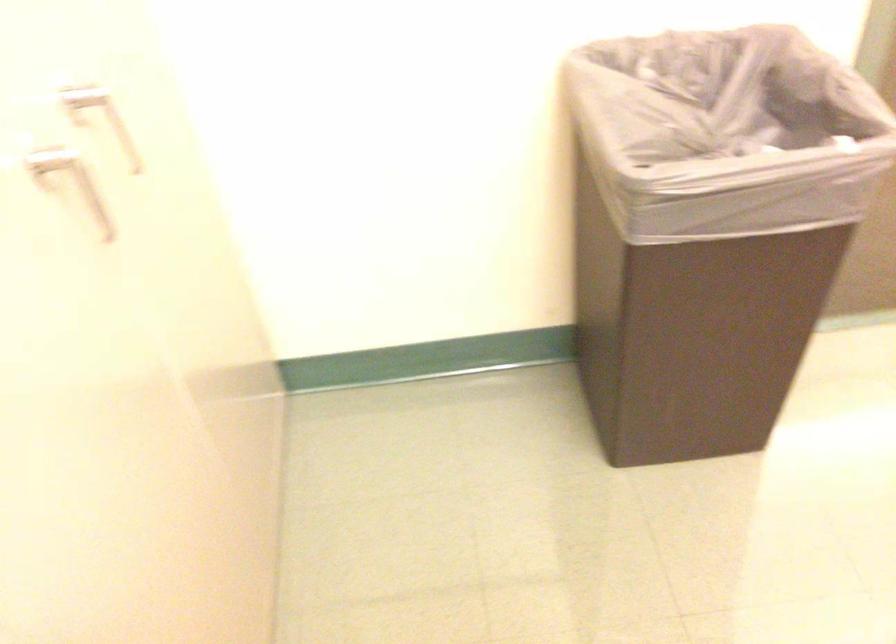
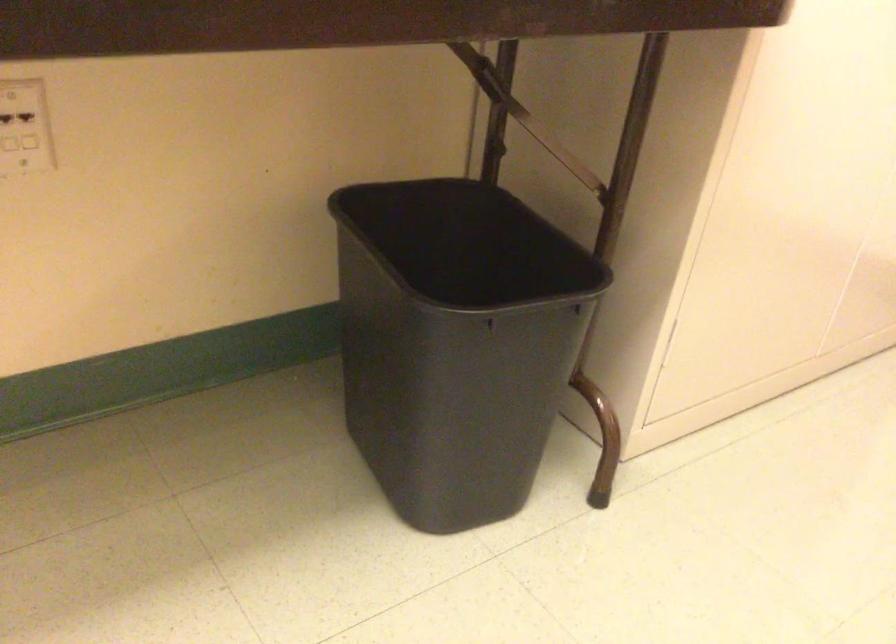
Question: The images are taken continuously from a first-person perspective. In which direction is your viewpoint rotating?

Choices:
 (A) Left
 (B) Right
 (C) Up
 (D) Down

Answer: (A)